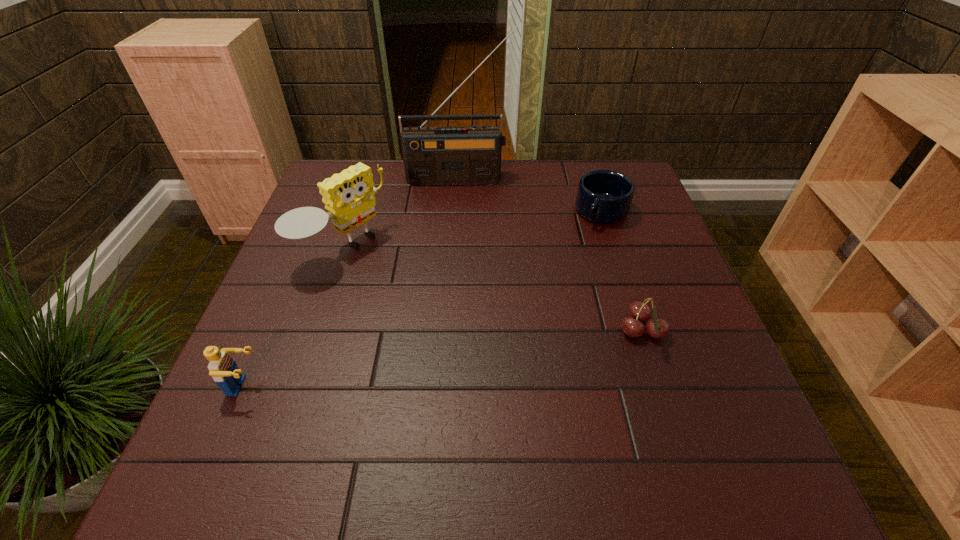
Locate an element on the screen. The width and height of the screenshot is (960, 540). vacant area at the right edge is located at coordinates 667,238.

What are the coordinates of `free space at the near left corner of the desktop` in the screenshot? It's located at (274, 413).

Identify the location of free point between the cherry and the third object from left to right. This screenshot has height=540, width=960. point(550,255).

At what (x,y) coordinates should I click in order to perform the action: click on vacant region between the third object from right to left and the fourth farthest object. Please return your answer as a coordinate pair (x, y). This screenshot has width=960, height=540. Looking at the image, I should click on (550, 255).

Locate an element on the screen. The height and width of the screenshot is (540, 960). free point between the mug and the cherry is located at coordinates (622, 272).

Find the location of a particular element. The image size is (960, 540). blank region between the sponge and the nearest object is located at coordinates (294, 317).

Find the location of a particular element. The image size is (960, 540). vacant region between the Lego and the radio receiver is located at coordinates (351, 282).

Identify the location of free space that is in between the cherry and the mug. Image resolution: width=960 pixels, height=540 pixels. (622, 272).

This screenshot has width=960, height=540. Identify the location of empty location between the cherry and the Lego. (444, 359).

Identify the location of empty space that is in between the mug and the third tallest object. (423, 299).